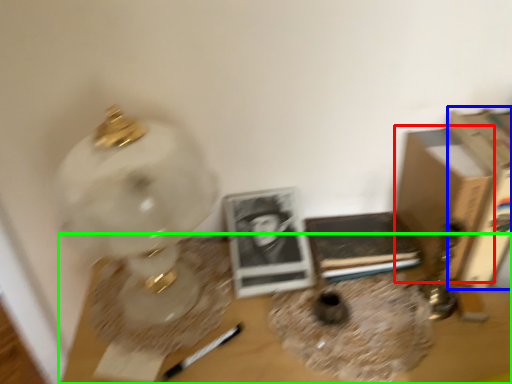
Question: Estimate the real-world distances between objects in this image. Which object is closer to cardboard box (highlighted by a red box), paperback book (highlighted by a blue box) or table (highlighted by a green box)?

Choices:
 (A) paperback book
 (B) table

Answer: (A)